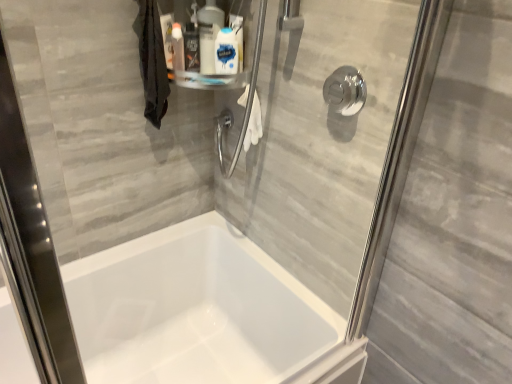
Question: Can you confirm if polished chrome shower handle at upper right is smaller than white glossy bottle at upper center, the 1th cleaning product from the right?

Choices:
 (A) yes
 (B) no

Answer: (B)

Question: Does polished chrome shower handle at upper right turn towards white glossy bottle at upper center, which is the 3th cleaning product in left-to-right order?

Choices:
 (A) no
 (B) yes

Answer: (A)

Question: Is polished chrome shower handle at upper right next to white glossy bottle at upper center, which is the 3th cleaning product in left-to-right order, and touching it?

Choices:
 (A) yes
 (B) no

Answer: (B)

Question: Is polished chrome shower handle at upper right shorter than white glossy bottle at upper center, which is the 3th cleaning product in left-to-right order?

Choices:
 (A) no
 (B) yes

Answer: (B)

Question: From the image's perspective, is polished chrome shower handle at upper right above white glossy bottle at upper center, the 1th cleaning product from the right?

Choices:
 (A) yes
 (B) no

Answer: (B)

Question: From the image's perspective, is polished chrome shower handle at upper right positioned above or below white glossy bottle at upper center, the 1th cleaning product from the right?

Choices:
 (A) below
 (B) above

Answer: (A)

Question: From a real-world perspective, is polished chrome shower handle at upper right positioned above or below white glossy bottle at upper center, which is the 3th cleaning product in left-to-right order?

Choices:
 (A) below
 (B) above

Answer: (A)

Question: Does point (355, 99) appear closer or farther from the camera than point (225, 38)?

Choices:
 (A) farther
 (B) closer

Answer: (B)

Question: Considering the relative positions of polished chrome shower handle at upper right and white glossy bottle at upper center, the 1th cleaning product from the right, in the image provided, is polished chrome shower handle at upper right to the left or to the right of white glossy bottle at upper center, the 1th cleaning product from the right,?

Choices:
 (A) right
 (B) left

Answer: (A)

Question: From a real-world perspective, relative to white glossy bottle at upper center, which ranks as the second cleaning product in left-to-right order, is white glossy bottle at upper center, which is the 3th cleaning product in left-to-right order, vertically above or below?

Choices:
 (A) above
 (B) below

Answer: (B)

Question: In terms of size, does white glossy bottle at upper center, which is the 3th cleaning product in left-to-right order, appear bigger or smaller than white glossy bottle at upper center, the second cleaning product from the right?

Choices:
 (A) small
 (B) big

Answer: (A)

Question: Is white glossy bottle at upper center, which is the 3th cleaning product in left-to-right order, inside or outside of white glossy bottle at upper center, the second cleaning product from the right?

Choices:
 (A) outside
 (B) inside

Answer: (A)

Question: In terms of height, does white glossy bottle at upper center, the 1th cleaning product from the right, look taller or shorter compared to white glossy bottle at upper center, which ranks as the second cleaning product in left-to-right order?

Choices:
 (A) tall
 (B) short

Answer: (B)

Question: Is white glossy bottle at upper center, the 1th cleaning product from the right, situated inside polished chrome shower handle at upper right or outside?

Choices:
 (A) outside
 (B) inside

Answer: (A)

Question: Is white glossy bottle at upper center, the 1th cleaning product from the right, to the left or to the right of polished chrome shower handle at upper right in the image?

Choices:
 (A) left
 (B) right

Answer: (A)